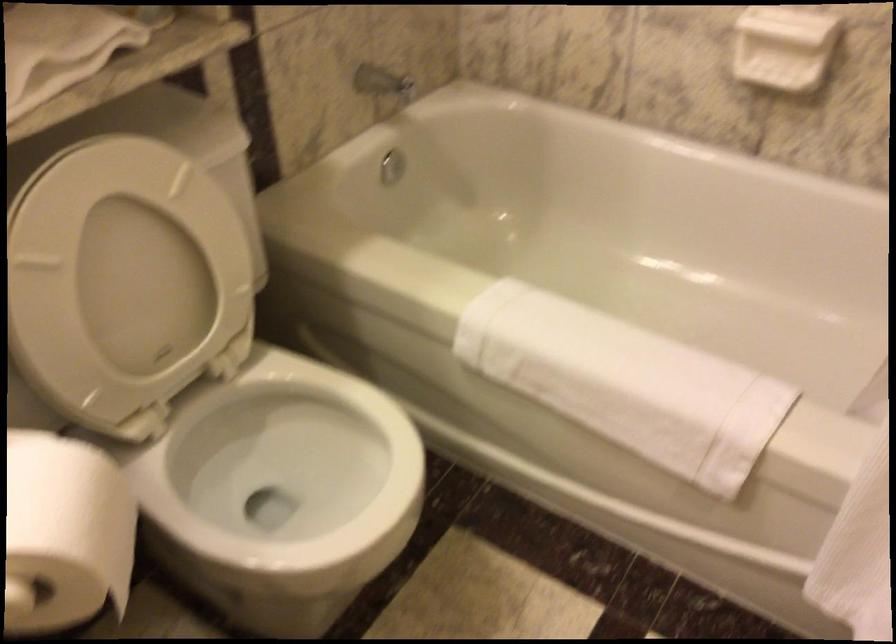
The image size is (896, 644). Describe the element at coordinates (126, 266) in the screenshot. I see `the white toilet lid` at that location.